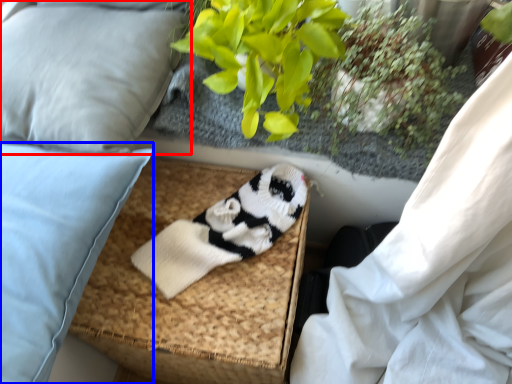
Question: Which of the following is the farthest to the observer, pillow (highlighted by a red box) or pillow (highlighted by a blue box)?

Choices:
 (A) pillow
 (B) pillow

Answer: (A)